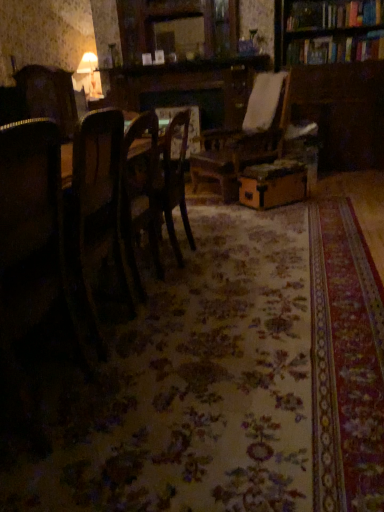
At what (x,y) coordinates should I click in order to perform the action: click on wooden chair at left, which appears as the 1th chair when viewed from the front. Please return your answer as a coordinate pair (x, y). The image size is (384, 512). Looking at the image, I should click on (33, 229).

The width and height of the screenshot is (384, 512). Describe the element at coordinates (152, 190) in the screenshot. I see `wooden table at center` at that location.

The width and height of the screenshot is (384, 512). Find the location of `dark wood chair at left, which is the second chair in front-to-back order`. dark wood chair at left, which is the second chair in front-to-back order is located at coordinates (49, 96).

I want to click on wooden chair at center, arranged as the 3th chair when viewed from the front, so click(x=176, y=177).

The height and width of the screenshot is (512, 384). I want to click on wooden chair at left, which appears as the 1th chair when viewed from the front, so click(x=33, y=229).

Which is more to the left, wooden table at center or wooden chair at center, positioned as the first chair in back-to-front order?

wooden table at center.

Considering the positions of points (147, 205) and (168, 144), is point (147, 205) closer to camera compared to point (168, 144)?

Yes, point (147, 205) is closer to viewer.

Is wooden table at center oriented away from wooden chair at center, arranged as the 3th chair when viewed from the front?

No.

From the image's perspective, starting from the wooden table at center, which chair is the 1st one above? Please provide its 2D coordinates.

[(176, 177)]

Is point (155, 160) closer or farther from the camera than point (298, 44)?

Clearly, point (155, 160) is closer to the camera than point (298, 44).

Are wooden table at center and wooden bookcase at upper right far apart?

Yes.

From the picture: Which object is closer to the camera, wooden table at center or wooden bookcase at upper right?

wooden table at center is in front.

Is wooden table at center aimed at wooden bookcase at upper right?

No, wooden table at center does not turn towards wooden bookcase at upper right.

Considering the relative sizes of matte white lampshade at upper left and brown cardboard box at center in the image provided, is matte white lampshade at upper left taller than brown cardboard box at center?

Yes.

Considering the points (92, 62) and (284, 162), which point is in front, point (92, 62) or point (284, 162)?

Point (284, 162)

Visually, is matte white lampshade at upper left positioned to the left or to the right of brown cardboard box at center?

Based on their positions, matte white lampshade at upper left is located to the left of brown cardboard box at center.

Is point (10, 160) farther from viewer compared to point (122, 179)?

No.

From the image's perspective, which object appears higher, wooden chair at left, which appears as the 1th chair when viewed from the front, or wooden table at center?

wooden table at center, from the image's perspective.

Is wooden chair at left, which appears as the 1th chair when viewed from the front, inside or outside of wooden table at center?

The correct answer is: outside.

Considering the sizes of brown cardboard box at center and matte white lampshade at upper left in the image, is brown cardboard box at center wider or thinner than matte white lampshade at upper left?

Clearly, brown cardboard box at center has more width compared to matte white lampshade at upper left.

Find the location of a particular element. lamp lying above the brown cardboard box at center (from the image's perspective) is located at coordinates (89, 70).

Looking at this image, how many degrees apart are the facing directions of brown cardboard box at center and matte white lampshade at upper left?

They differ by 44.5 degrees in their facing directions.

Can you see wooden chair at left, which appears as the 1th chair when viewed from the front, touching brown cardboard box at center?

wooden chair at left, which appears as the 1th chair when viewed from the front, is not next to brown cardboard box at center, and they're not touching.

Between wooden chair at left, which is the 3th chair from back to front, and brown cardboard box at center, which one has larger width?

brown cardboard box at center is wider.

Who is shorter, wooden chair at left, which is the 3th chair from back to front, or brown cardboard box at center?

brown cardboard box at center is shorter.

From a real-world perspective, is wooden chair at left, which is the 3th chair from back to front, on top of brown cardboard box at center?

Yes.

Based on the photo, who is more distant, wooden chair at center, arranged as the 3th chair when viewed from the front, or matte white lampshade at upper left?

matte white lampshade at upper left.

Are wooden chair at center, arranged as the 3th chair when viewed from the front, and matte white lampshade at upper left located far from each other?

Yes, wooden chair at center, arranged as the 3th chair when viewed from the front, and matte white lampshade at upper left are located far from each other.

Is wooden chair at center, positioned as the first chair in back-to-front order, aimed at matte white lampshade at upper left?

No, wooden chair at center, positioned as the first chair in back-to-front order, is not aimed at matte white lampshade at upper left.

Considering the positions of objects wooden chair at center, positioned as the first chair in back-to-front order, and matte white lampshade at upper left in the image provided, who is more to the right, wooden chair at center, positioned as the first chair in back-to-front order, or matte white lampshade at upper left?

wooden chair at center, positioned as the first chair in back-to-front order.

In order to click on chair on the right of wooden table at center in this screenshot , I will do `click(176, 177)`.

Identify the location of kitchen & dining room table in front of the wooden bookcase at upper right. Image resolution: width=384 pixels, height=512 pixels. (152, 190).

Considering their positions, is wooden chair at left, which appears as the 1th chair when viewed from the front, positioned further to brown cardboard box at center than dark wood chair at left, which is the second chair in front-to-back order?

The object further to brown cardboard box at center is wooden chair at left, which appears as the 1th chair when viewed from the front.

Looking at the image, which one is located closer to dark wood chair at left, the second chair in the back-to-front sequence, matte white lampshade at upper left or wooden bookcase at upper right?

wooden bookcase at upper right.

Looking at the image, which one is located closer to wooden bookcase at upper right, wooden table at center or brown cardboard box at center?

brown cardboard box at center is closer to wooden bookcase at upper right.

Looking at the image, which one is located further to matte white lampshade at upper left, wooden chair at left, which is the 3th chair from back to front, or wooden bookcase at upper right?

wooden chair at left, which is the 3th chair from back to front, is positioned further to the anchor matte white lampshade at upper left.

From the image, which object appears to be nearer to wooden table at center, wooden chair at left, which is the 3th chair from back to front, or dark wood chair at left, the second chair in the back-to-front sequence?

The object closer to wooden table at center is dark wood chair at left, the second chair in the back-to-front sequence.

When comparing their distances from wooden table at center, does brown cardboard box at center or wooden chair at center, arranged as the 3th chair when viewed from the front, seem closer?

wooden chair at center, arranged as the 3th chair when viewed from the front.

From the picture: From the image, which object appears to be nearer to wooden bookcase at upper right, dark wood chair at left, which is the second chair in front-to-back order, or wooden table at center?

wooden table at center is closer to wooden bookcase at upper right.

From the picture: From the image, which object appears to be farther from wooden chair at left, which is the 3th chair from back to front, wooden table at center or matte white lampshade at upper left?

matte white lampshade at upper left is positioned further to the anchor wooden chair at left, which is the 3th chair from back to front.

The image size is (384, 512). Find the location of `cardboard box located between wooden chair at center, positioned as the first chair in back-to-front order, and matte white lampshade at upper left in the depth direction`. cardboard box located between wooden chair at center, positioned as the first chair in back-to-front order, and matte white lampshade at upper left in the depth direction is located at coordinates (273, 184).

Where is `cardboard box located between wooden table at center and matte white lampshade at upper left in the depth direction`? This screenshot has height=512, width=384. cardboard box located between wooden table at center and matte white lampshade at upper left in the depth direction is located at coordinates (273, 184).

The image size is (384, 512). Find the location of `cardboard box between wooden chair at left, which is the 3th chair from back to front, and wooden bookcase at upper right in the front-back direction`. cardboard box between wooden chair at left, which is the 3th chair from back to front, and wooden bookcase at upper right in the front-back direction is located at coordinates (273, 184).

Identify the location of chair between dark wood chair at left, which is the second chair in front-to-back order, and matte white lampshade at upper left, along the z-axis. This screenshot has height=512, width=384. click(176, 177).